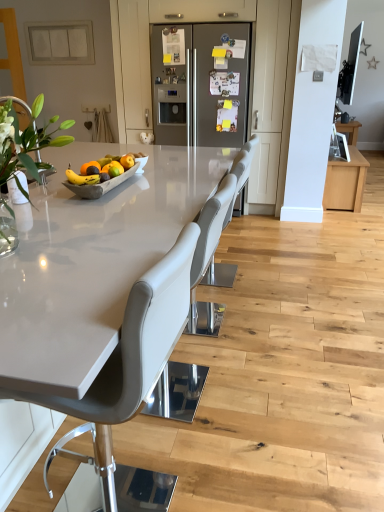
Locate an element on the screen. This screenshot has height=512, width=384. vacant space to the right of gray leather chair at center, the second chair from the back is located at coordinates (261, 391).